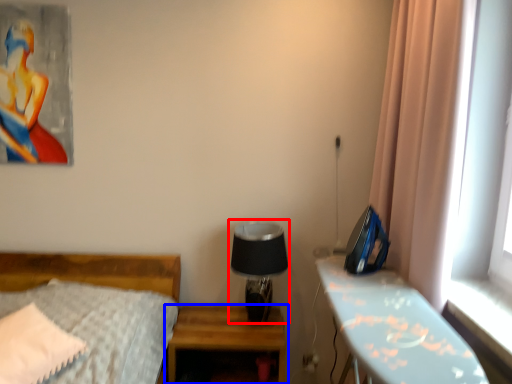
Question: Which object appears farthest to the camera in this image, table lamp (highlighted by a red box) or nightstand (highlighted by a blue box)?

Choices:
 (A) table lamp
 (B) nightstand

Answer: (A)